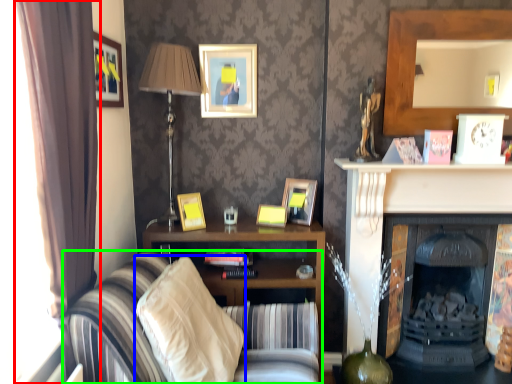
Question: Estimate the real-world distances between objects in this image. Which object is farther from curtain (highlighted by a red box), pillow (highlighted by a blue box) or studio couch (highlighted by a green box)?

Choices:
 (A) pillow
 (B) studio couch

Answer: (A)